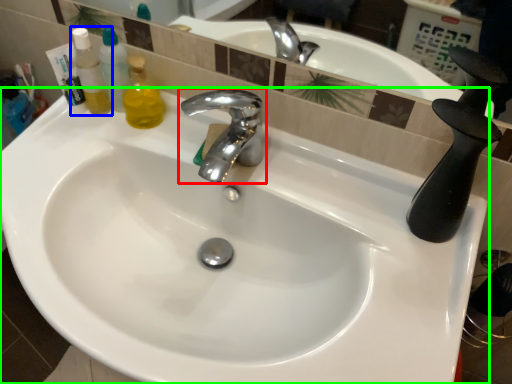
Question: Considering the real-world distances, which object is closest to tap (highlighted by a red box)? mouthwash (highlighted by a blue box) or sink (highlighted by a green box).

Choices:
 (A) mouthwash
 (B) sink

Answer: (B)